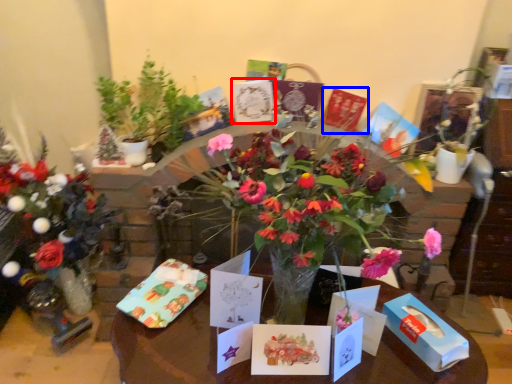
Question: Which point is closer to the camera, birthday card (highlighted by a red box) or birthday card (highlighted by a blue box)?

Choices:
 (A) birthday card
 (B) birthday card

Answer: (A)